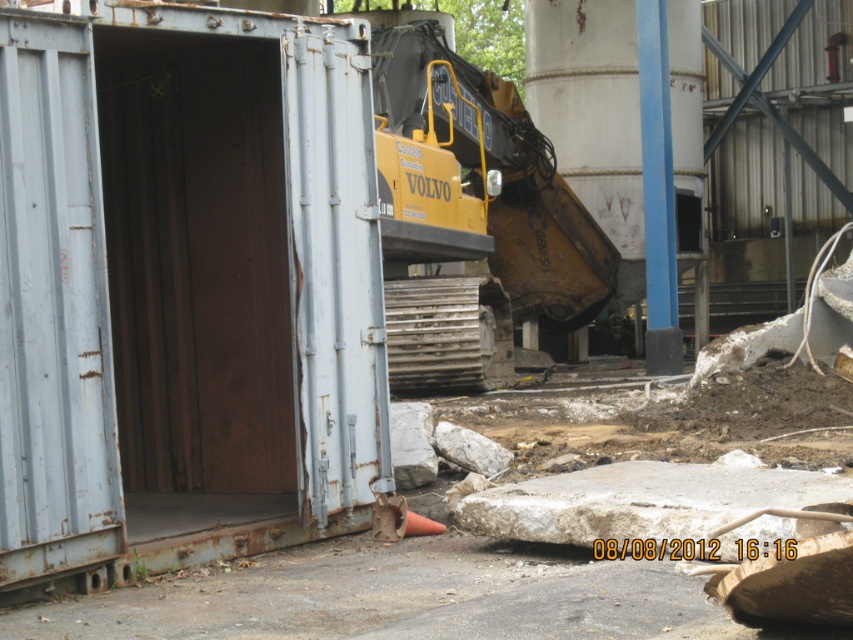
Question: Which point is farther from the camera taking this photo?

Choices:
 (A) (463, 104)
 (B) (239, 518)

Answer: (A)

Question: Does rusty metal shipping container at left have a smaller size compared to yellow metallic excavator at center?

Choices:
 (A) yes
 (B) no

Answer: (B)

Question: Among these points, which one is farthest from the camera?

Choices:
 (A) (589, 256)
 (B) (27, 440)

Answer: (A)

Question: Is rusty metal shipping container at left bigger than yellow metallic excavator at center?

Choices:
 (A) yes
 (B) no

Answer: (A)

Question: Can you confirm if rusty metal shipping container at left is positioned to the right of yellow metallic excavator at center?

Choices:
 (A) yes
 (B) no

Answer: (B)